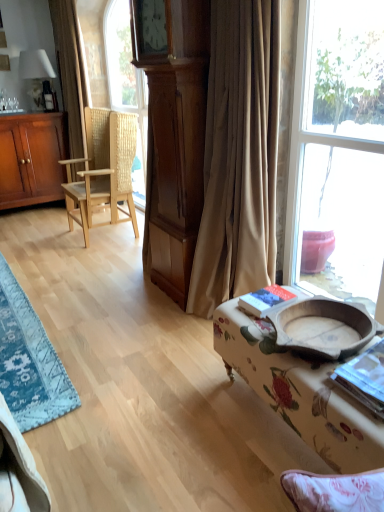
Question: Is natural wood woven chair at left oriented away from beige fabric curtain at center, acting as the first curtain starting from the front?

Choices:
 (A) no
 (B) yes

Answer: (A)

Question: Considering the relative positions of natural wood woven chair at left and beige fabric curtain at center, positioned as the 2th curtain in left-to-right order, in the image provided, is natural wood woven chair at left to the right of beige fabric curtain at center, positioned as the 2th curtain in left-to-right order, from the viewer's perspective?

Choices:
 (A) no
 (B) yes

Answer: (A)

Question: Is the position of natural wood woven chair at left more distant than that of beige fabric curtain at center, positioned as the first curtain in right-to-left order?

Choices:
 (A) yes
 (B) no

Answer: (A)

Question: Could you tell me if natural wood woven chair at left is turned towards beige fabric curtain at center, acting as the first curtain starting from the front?

Choices:
 (A) yes
 (B) no

Answer: (B)

Question: From a real-world perspective, is natural wood woven chair at left physically below beige fabric curtain at center, placed as the second curtain when sorted from back to front?

Choices:
 (A) yes
 (B) no

Answer: (A)

Question: Is point pos(33,181) closer or farther from the camera than point pos(14,305)?

Choices:
 (A) farther
 (B) closer

Answer: (A)

Question: Relative to blue woven rug at lower left, is matte brown cabinet at left in front or behind?

Choices:
 (A) front
 (B) behind

Answer: (B)

Question: From the image's perspective, relative to blue woven rug at lower left, is matte brown cabinet at left above or below?

Choices:
 (A) below
 (B) above

Answer: (B)

Question: Looking at the image, does matte brown cabinet at left seem bigger or smaller compared to blue woven rug at lower left?

Choices:
 (A) big
 (B) small

Answer: (A)

Question: Is blue woven rug at lower left situated inside floral fabric ottoman at lower right or outside?

Choices:
 (A) inside
 (B) outside

Answer: (B)

Question: Is point (39, 378) positioned closer to the camera than point (288, 362)?

Choices:
 (A) farther
 (B) closer

Answer: (A)

Question: From the image's perspective, is blue woven rug at lower left above or below floral fabric ottoman at lower right?

Choices:
 (A) below
 (B) above

Answer: (B)

Question: Considering the relative positions of blue woven rug at lower left and floral fabric ottoman at lower right in the image provided, is blue woven rug at lower left to the left or to the right of floral fabric ottoman at lower right?

Choices:
 (A) right
 (B) left

Answer: (B)

Question: From the image's perspective, is floral fabric ottoman at lower right above or below brown textured curtain at left, which ranks as the 1th curtain in back-to-front order?

Choices:
 (A) below
 (B) above

Answer: (A)

Question: Is point (238, 322) closer or farther from the camera than point (57, 54)?

Choices:
 (A) farther
 (B) closer

Answer: (B)